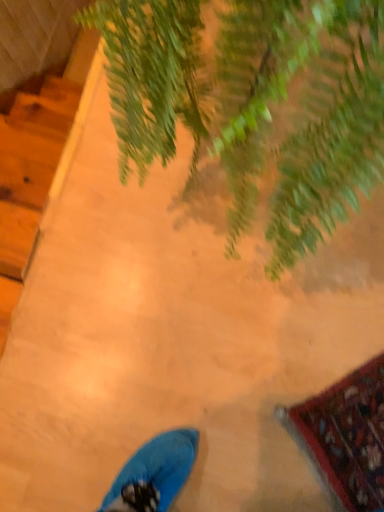
What do you see at coordinates (254, 102) in the screenshot? I see `green leafy plant at upper center` at bounding box center [254, 102].

This screenshot has width=384, height=512. Identify the location of green leafy plant at upper center. (254, 102).

Find the location of a particular element. green leafy plant at upper center is located at coordinates (254, 102).